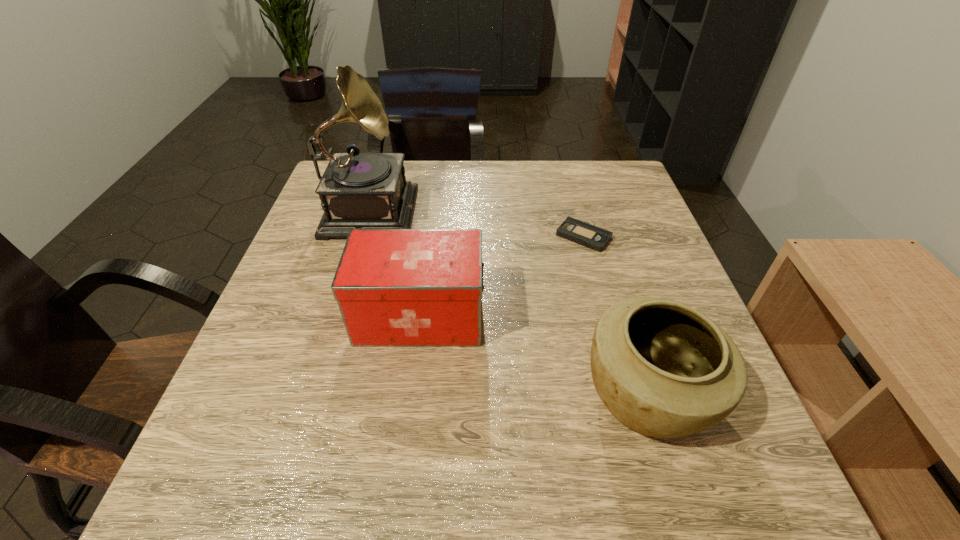
I want to click on object at the left edge, so click(x=358, y=190).

Where is `pottery that is at the right edge`? The image size is (960, 540). pottery that is at the right edge is located at coordinates (663, 369).

Locate an element on the screen. This screenshot has height=540, width=960. videotape located in the right edge section of the desktop is located at coordinates (593, 237).

You are a GUI agent. You are given a task and a screenshot of the screen. Output one action in this format:
    pyautogui.click(x=<x>, y=<y>)
    Task: Click on the object that is at the far left corner
    Image resolution: width=960 pixels, height=540 pixels.
    Given the screenshot: What is the action you would take?
    pyautogui.click(x=358, y=190)

Locate an element on the screen. The width and height of the screenshot is (960, 540). object at the near right corner is located at coordinates (663, 369).

You are a GUI agent. You are given a task and a screenshot of the screen. Output one action in this format:
    pyautogui.click(x=<x>, y=<y>)
    Task: Click on the vacant space at the far edge of the desktop
    Image resolution: width=960 pixels, height=540 pixels.
    Given the screenshot: What is the action you would take?
    pyautogui.click(x=568, y=172)

Locate an element on the screen. The height and width of the screenshot is (540, 960). free spot at the near edge of the desktop is located at coordinates (649, 465).

The image size is (960, 540). In the image, there is a desktop. Identify the location of vacant space at the left edge. (237, 366).

Image resolution: width=960 pixels, height=540 pixels. I want to click on free space at the right edge of the desktop, so coord(614,221).

At what (x,y) coordinates should I click in order to perform the action: click on free location at the near left corner. Please return your answer as a coordinate pair (x, y). The height and width of the screenshot is (540, 960). Looking at the image, I should click on (252, 508).